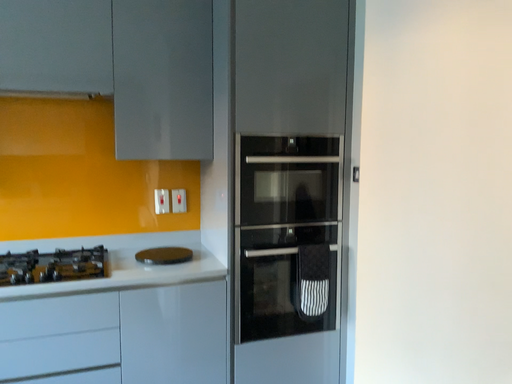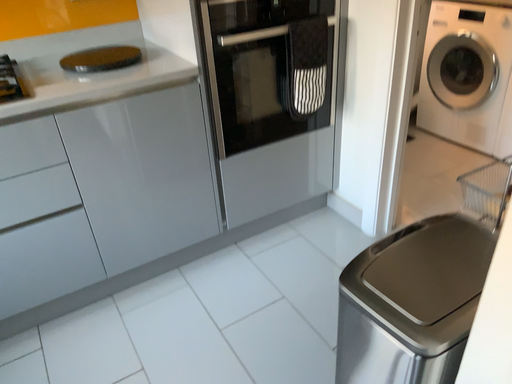
Question: How did the camera likely rotate when shooting the video?

Choices:
 (A) rotated right
 (B) rotated left

Answer: (A)